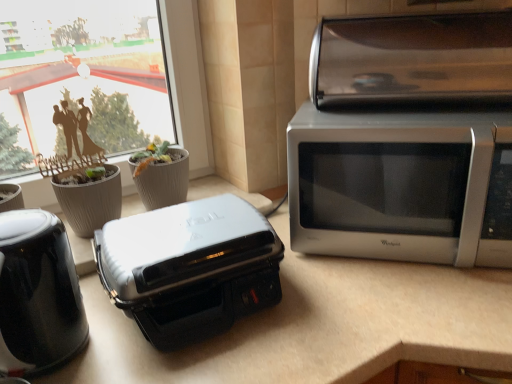
What are the coordinates of `free space above black glossy kettle at left (from a real-world perspective)` in the screenshot? It's located at (22, 228).